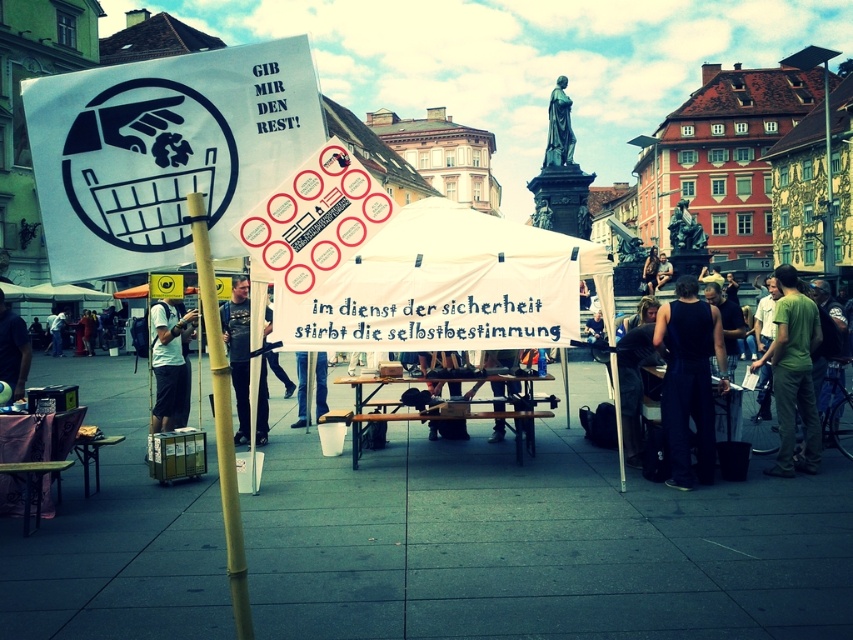
You are standing in the town square and want to take a photo of the protest signs. The camera you are using has a maximum focus distance of 60 feet. Can you focus on the point at coordinates point (368, 621) without moving closer?

The point at coordinates point (368, 621) is 62.55 feet away from the camera, which exceeds the maximum focus distance of 60 feet. Therefore, you cannot focus on it without moving closer.